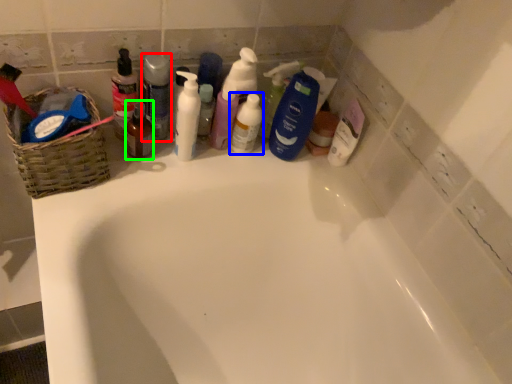
Question: Considering the real-world distances, which object is farthest from cleaning product (highlighted by a red box)? cleaning product (highlighted by a blue box) or mouthwash (highlighted by a green box)?

Choices:
 (A) cleaning product
 (B) mouthwash

Answer: (A)